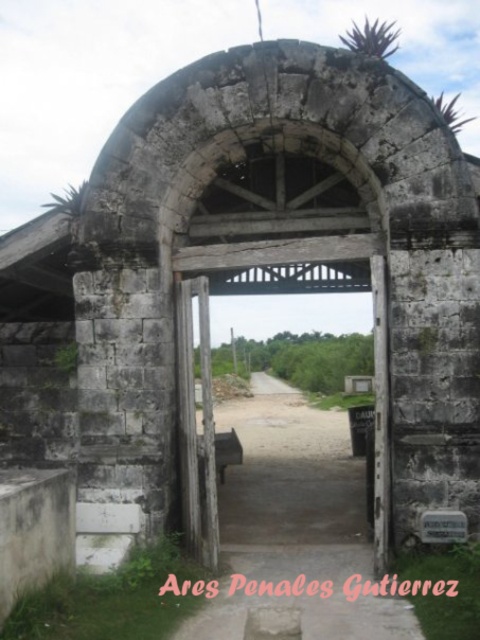
Does dirt/gravel path at center have a larger size compared to weathered wood gate at center?

No, dirt/gravel path at center is not bigger than weathered wood gate at center.

Does dirt/gravel path at center lie behind weathered wood gate at center?

That is False.

Does point (279, 572) come in front of point (204, 396)?

No, it is behind (204, 396).

Find the location of a particular element. dirt/gravel path at center is located at coordinates (294, 529).